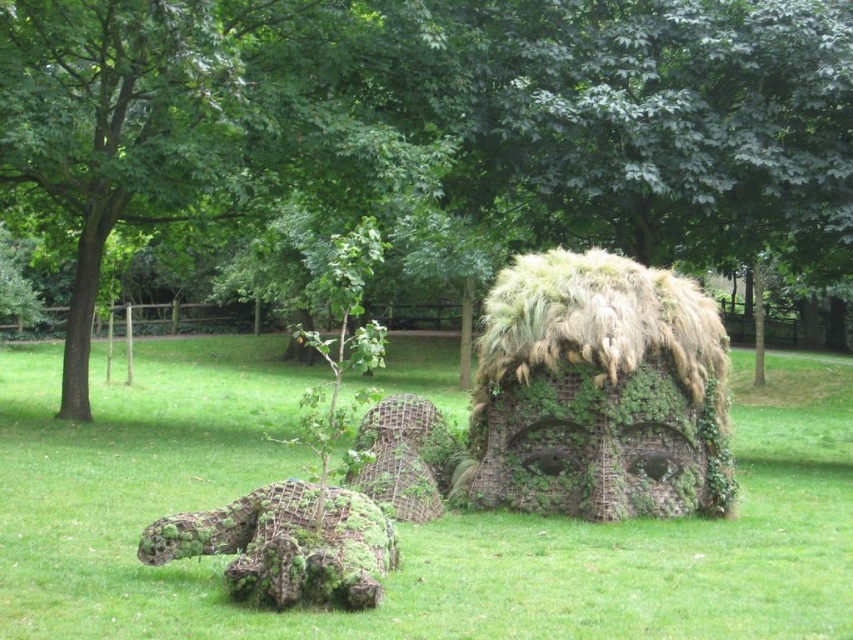
Does green mossy tree at center appear over green mossy sculpture at center?

Yes, green mossy tree at center is above green mossy sculpture at center.

Does green mossy tree at center appear under green mossy sculpture at center?

No, green mossy tree at center is not below green mossy sculpture at center.

Identify the location of green mossy tree at center. Image resolution: width=853 pixels, height=640 pixels. (438, 120).